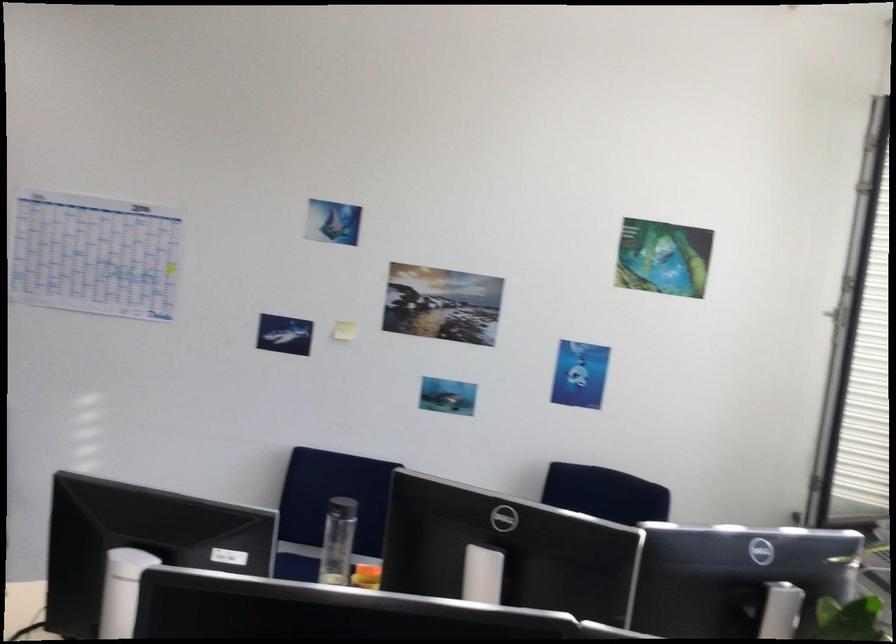
Where would you lift the clear water bottle? Please return your answer as a coordinate pair (x, y).

(338, 541)